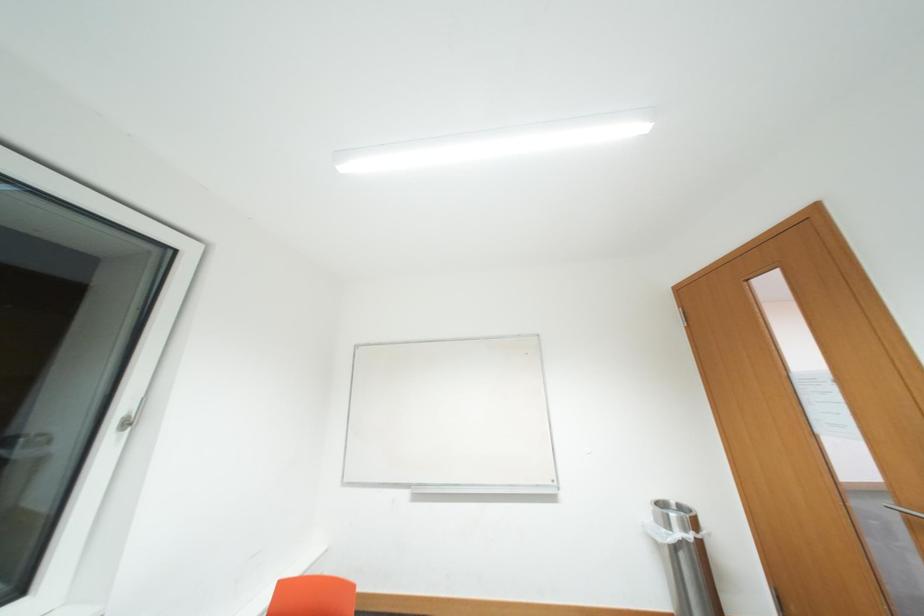
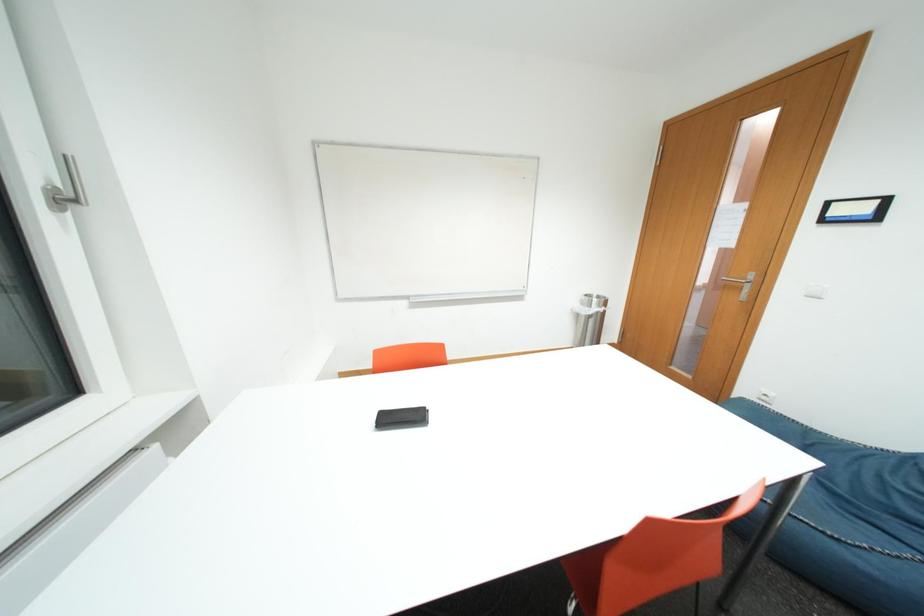
First-person continuous shooting, in which direction is the camera rotating?

The camera rotated toward right-down.